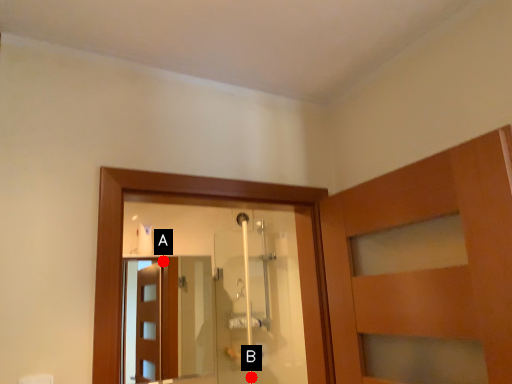
Question: Two points are circled on the image, labeled by A and B beside each circle. Which point is closer to the camera?

Choices:
 (A) A is closer
 (B) B is closer

Answer: (B)